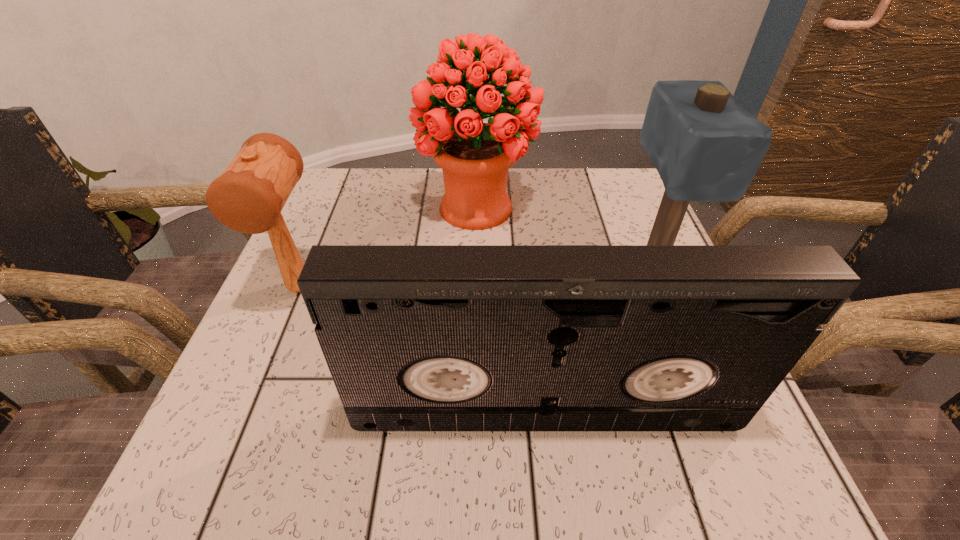
This screenshot has width=960, height=540. I want to click on bouquet, so click(x=475, y=157).

Locate an element on the screen. This screenshot has height=540, width=960. the right mallet is located at coordinates (705, 146).

Find the location of a particular element. This screenshot has width=960, height=540. the nearest object is located at coordinates (416, 337).

The height and width of the screenshot is (540, 960). Identify the location of the leftmost object. (248, 197).

Identify the location of the left mallet. (248, 197).

Locate an element on the screen. free space located 0.240m on the left of the bouquet is located at coordinates (318, 208).

The image size is (960, 540). What are the coordinates of `vacant area situated on the front of the right mallet` in the screenshot? It's located at (741, 484).

Image resolution: width=960 pixels, height=540 pixels. What are the coordinates of `free region located 0.050m on the front side of the videotape` in the screenshot? It's located at (551, 467).

Locate an element on the screen. This screenshot has width=960, height=540. vacant space located on the strike surface of the leftmost object is located at coordinates (266, 372).

Find the location of `object that is positioned at the far edge`. object that is positioned at the far edge is located at coordinates (475, 157).